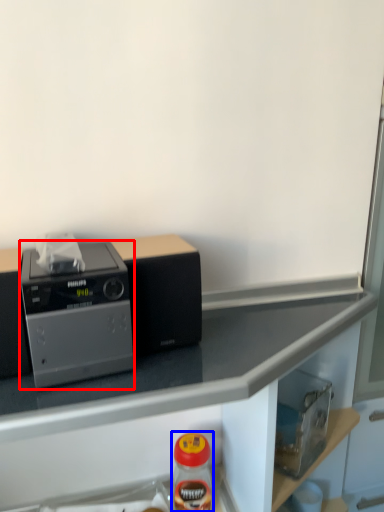
Question: Which object appears farthest to the camera in this image, home appliance (highlighted by a red box) or bottle (highlighted by a blue box)?

Choices:
 (A) home appliance
 (B) bottle

Answer: (B)